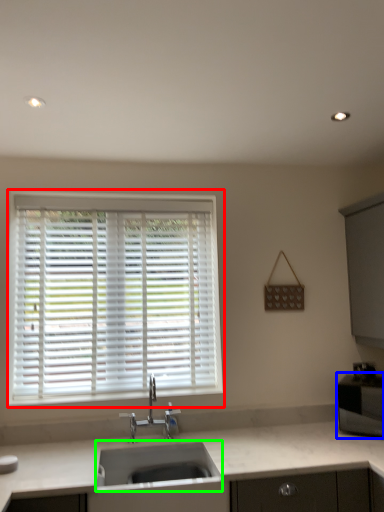
Question: Which object is positioned farthest from window (highlighted by a red box)? Select from appliance (highlighted by a blue box) and sink (highlighted by a green box).

Choices:
 (A) appliance
 (B) sink

Answer: (A)